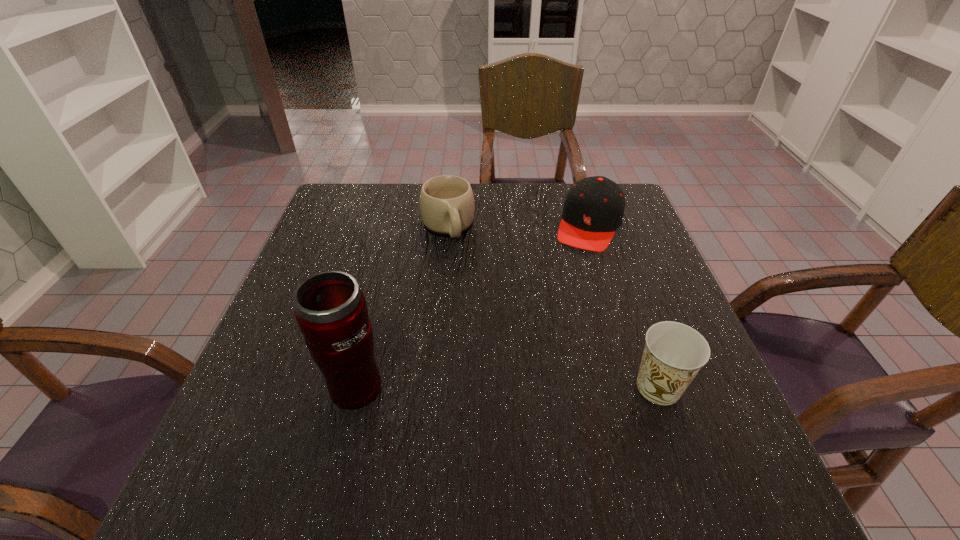
You are a GUI agent. You are given a task and a screenshot of the screen. Output one action in this format:
    pyautogui.click(x=<x>, y=<y>)
    Task: Click on the free space on the desktop that is between the thermos bottle and the Dixie cup and is positioned on the side of the mug with the handle
    The height and width of the screenshot is (540, 960).
    Given the screenshot: What is the action you would take?
    tap(509, 386)

I want to click on vacant space on the desktop that is between the leftmost object and the Dixie cup and is positioned on the front-facing side of the cap, so click(521, 386).